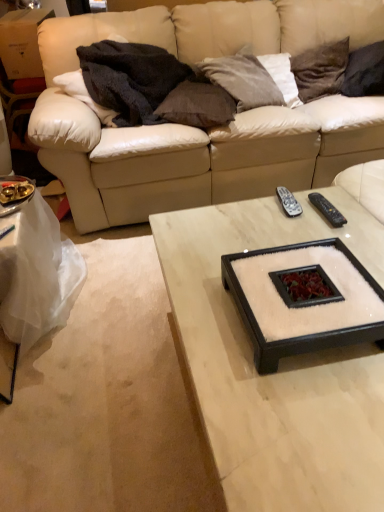
Question: Is dark gray fabric pillow at upper right, acting as the 4th pillow starting from the left, at the right side of beige leather couch at upper center?

Choices:
 (A) yes
 (B) no

Answer: (A)

Question: Can you confirm if dark gray fabric pillow at upper right, acting as the 4th pillow starting from the left, is positioned to the left of beige leather couch at upper center?

Choices:
 (A) yes
 (B) no

Answer: (B)

Question: Does dark gray fabric pillow at upper right, acting as the first pillow starting from the right, come in front of beige leather couch at upper center?

Choices:
 (A) yes
 (B) no

Answer: (B)

Question: Considering the relative sizes of dark gray fabric pillow at upper right, acting as the 4th pillow starting from the left, and beige leather couch at upper center in the image provided, is dark gray fabric pillow at upper right, acting as the 4th pillow starting from the left, thinner than beige leather couch at upper center?

Choices:
 (A) yes
 (B) no

Answer: (A)

Question: From the image's perspective, would you say dark gray fabric pillow at upper right, acting as the 4th pillow starting from the left, is positioned over beige leather couch at upper center?

Choices:
 (A) yes
 (B) no

Answer: (A)

Question: Can you confirm if dark gray fabric pillow at upper right, acting as the first pillow starting from the right, is smaller than beige leather couch at upper center?

Choices:
 (A) yes
 (B) no

Answer: (A)

Question: Would you say white felt square tray at center is part of black plastic remote control at right, marked as the first remote control in a right-to-left arrangement,'s contents?

Choices:
 (A) yes
 (B) no

Answer: (B)

Question: Is black plastic remote control at right, marked as the first remote control in a right-to-left arrangement, far away from white felt square tray at center?

Choices:
 (A) no
 (B) yes

Answer: (A)

Question: Is black plastic remote control at right, marked as the second remote control in a left-to-right arrangement, smaller than white felt square tray at center?

Choices:
 (A) yes
 (B) no

Answer: (A)

Question: Can you confirm if black plastic remote control at right, marked as the first remote control in a right-to-left arrangement, is wider than white felt square tray at center?

Choices:
 (A) no
 (B) yes

Answer: (A)

Question: From the image's perspective, is black plastic remote control at right, marked as the second remote control in a left-to-right arrangement, over white felt square tray at center?

Choices:
 (A) yes
 (B) no

Answer: (A)

Question: From a real-world perspective, is black plastic remote control at right, marked as the second remote control in a left-to-right arrangement, beneath white felt square tray at center?

Choices:
 (A) yes
 (B) no

Answer: (A)

Question: Does dark gray fabric pillow at upper right, acting as the 4th pillow starting from the left, have a larger size compared to brown fabric pillow at upper center, which ranks as the first pillow in left-to-right order?

Choices:
 (A) no
 (B) yes

Answer: (B)